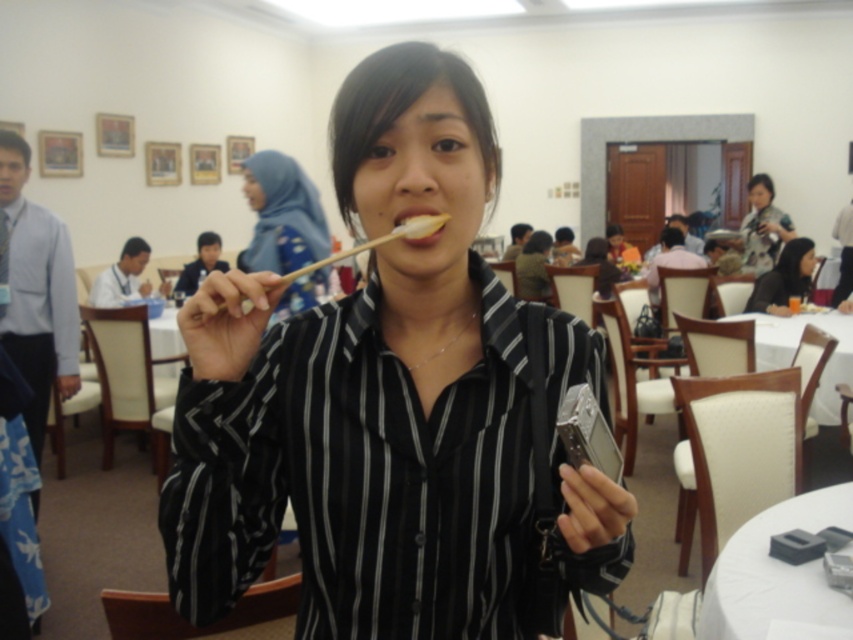
You are standing at the point labeled point (799, 266) in the conference room. You want to walk to the point labeled point (526, 381). Which direction should you move in?

You should move forward because point (526, 381) is in front of point (799, 266).

You are standing in the conference room and want to take a photo of the point at coordinates (x=213, y=502). The camera you have can only focus on objects within 30 inches. Will the point be in focus?

The point at coordinates (x=213, y=502) is 30.61 inches away from the viewer, which is slightly beyond the camera focus range of 30 inches. Therefore, the point will not be in focus.

You are organizing a clothing donation drive and need to determine if the black striped shirt at center and the black fabric shirt at center can be placed side by side on a shelf that is 1 meter wide. Based on their widths, will they fit together?

The black striped shirt at center has a lesser width compared to the black fabric shirt at center. Since their combined widths must be less than or equal to 1 meter to fit, but we don not have exact measurements, it is uncertain if they will fit together.